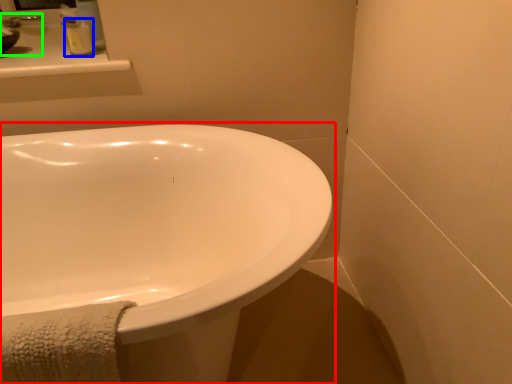
Question: Estimate the real-world distances between objects in this image. Which object is farther from bathtub (highlighted by a red box), soap dispenser (highlighted by a blue box) or sink (highlighted by a green box)?

Choices:
 (A) soap dispenser
 (B) sink

Answer: (B)